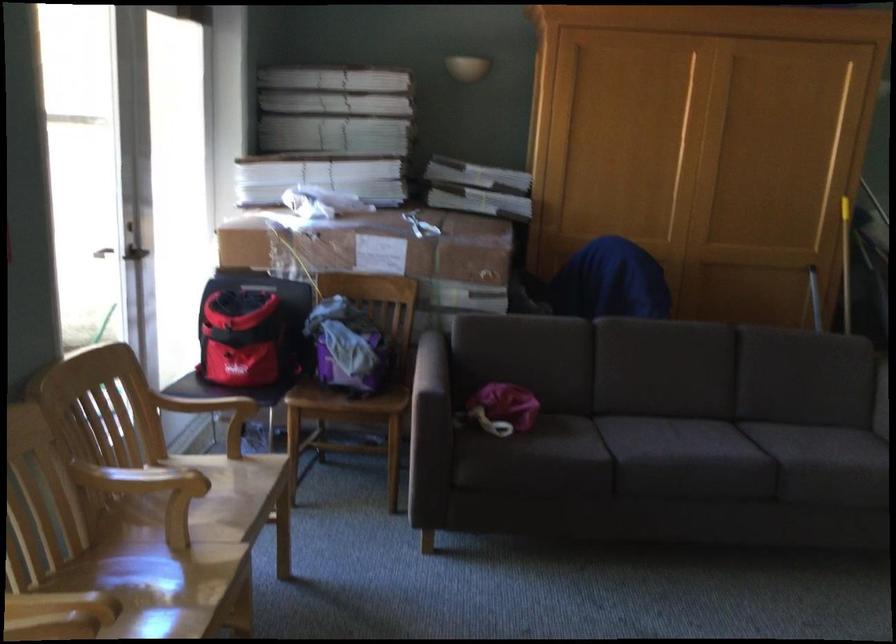
The height and width of the screenshot is (644, 896). In order to click on pink bag in this screenshot , I will do `click(503, 408)`.